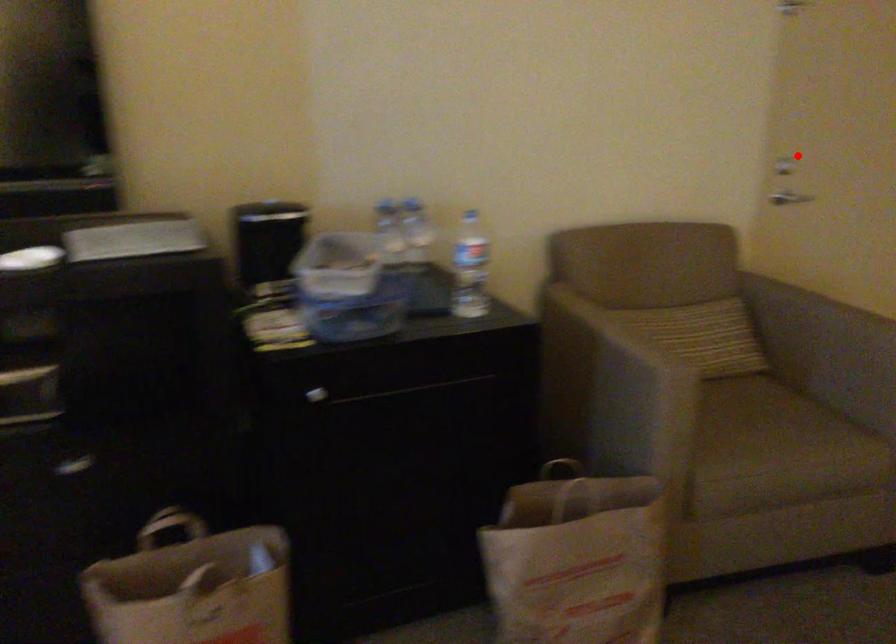
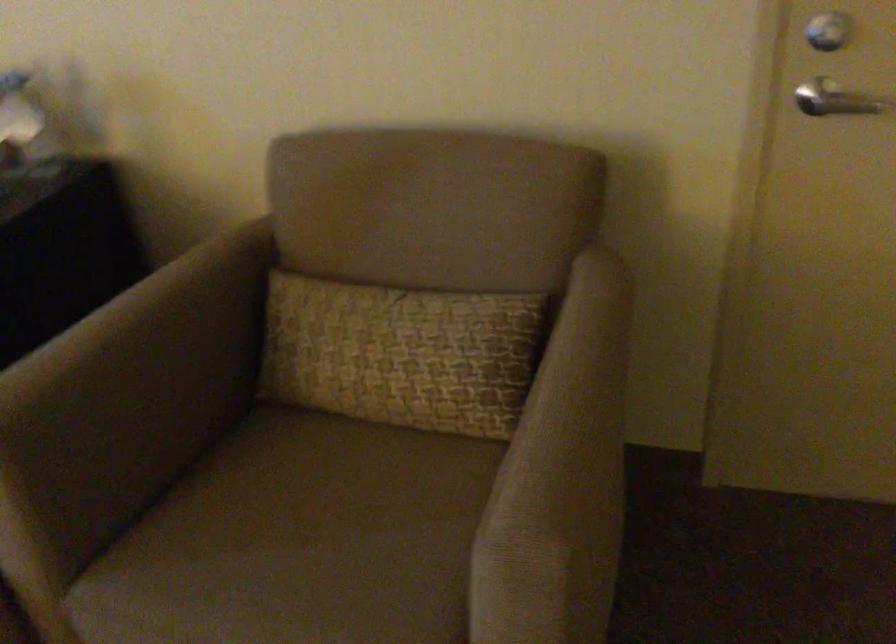
Find the pixel in the second image that matches the highlighted location in the first image.

(829, 31)